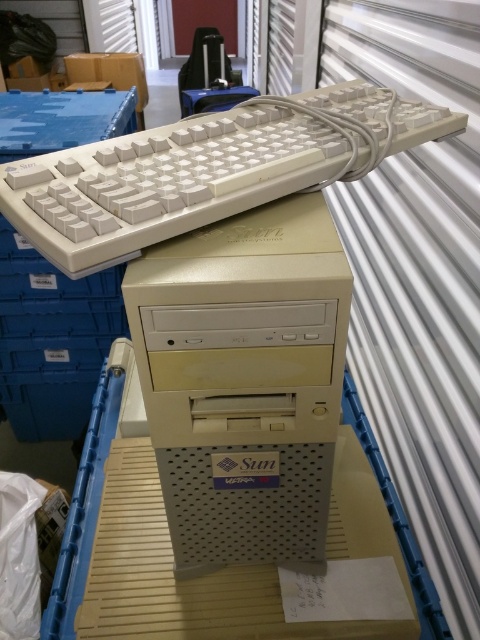
You are holding a 12 inch ruler and want to measure the distance between the point at coordinates (x=183, y=337) and yourself. Can your ruler reach that point?

The distance between point (x=183, y=337) and the viewer is 18.10 inches. Since your ruler is only 12 inches long, it cannot reach the point as it is shorter than the required distance.

You are setting up a workspace in the warehouse and have the white plastic keyboard at upper center and the white plastic computer desk at center. Since the keyboard is larger than the desk, will it fit on the desk?

The white plastic keyboard at upper center is larger in width than the white plastic computer desk at center, so it will not fit on the desk.